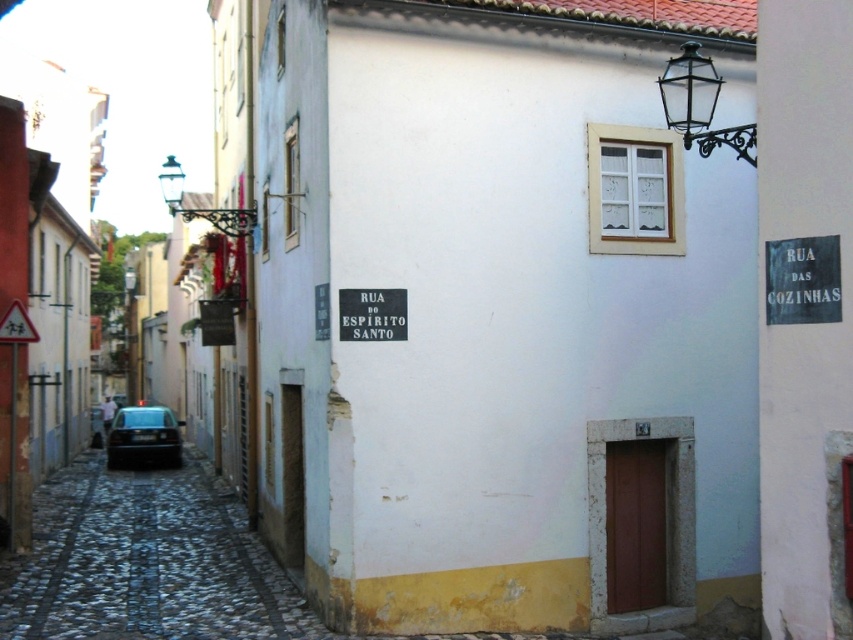
You are a tourist standing in the middle of the street. You want to take a photo of the black wrought iron lantern at upper right and the dark gray metallic car at lower left. Which object should you focus on first to ensure both are in the frame?

You should focus on the black wrought iron lantern at upper right first because it is closer to the viewer than the dark gray metallic car at lower left, so adjusting the camera to its distance will help include both in the frame.

You are a tourist standing in the middle of the narrow street. You notice two decorations on the buildings above you. The first is the black wrought iron lantern at upper right and the second is the yellow plastic triangle at upper left. Which decoration is taller?

The black wrought iron lantern at upper right is taller than the yellow plastic triangle at upper left according to the description.